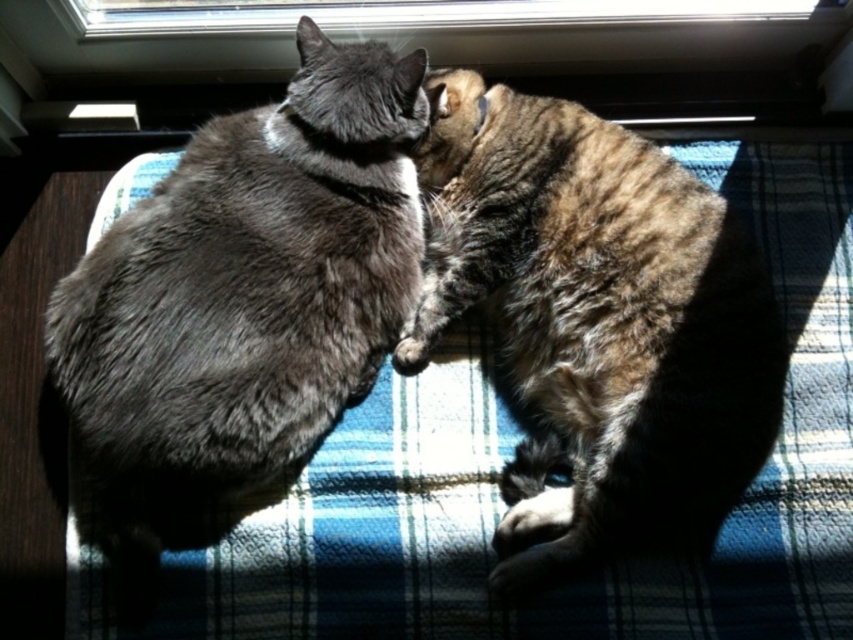
You are a photographer trying to capture a closeup of the gray fur cat at center and the tabby fur cat at center. Based on their positions, which cat would you focus on first to ensure both are in the frame?

The gray fur cat at center is located above the tabby fur cat at center, so focusing on the gray fur cat at center first would ensure both are in the frame since it is positioned higher up.

From the picture: You are a photographer trying to capture a photo of the gray fur cat at center and the transparent glass window at upper center. Which object is positioned lower in the image?

The gray fur cat at center is located below the transparent glass window at upper center, so the gray fur cat at center is positioned lower in the image.

You are a photographer trying to capture both the tabby fur cat at center and the transparent glass window at upper center in a single shot. Based on their sizes, which object should you focus on first to ensure both are in frame?

The tabby fur cat at center is taller than the transparent glass window at upper center, so you should focus on the tabby fur cat at center first to ensure both fit in the frame.